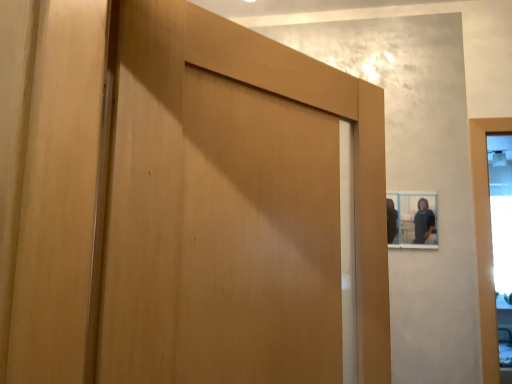
Find the location of a particular element. matte plastic picture frame at upper right is located at coordinates (412, 219).

Describe the element at coordinates (412, 219) in the screenshot. This screenshot has height=384, width=512. I see `matte plastic picture frame at upper right` at that location.

Locate an element on the screen. This screenshot has height=384, width=512. matte plastic picture frame at upper right is located at coordinates (412, 219).